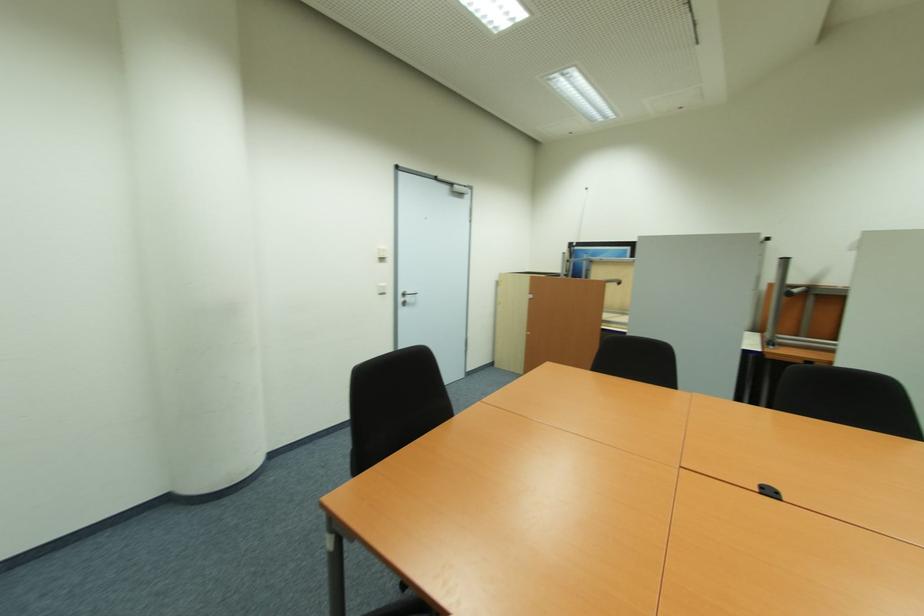
What do you see at coordinates (407, 294) in the screenshot? I see `a metal door handle` at bounding box center [407, 294].